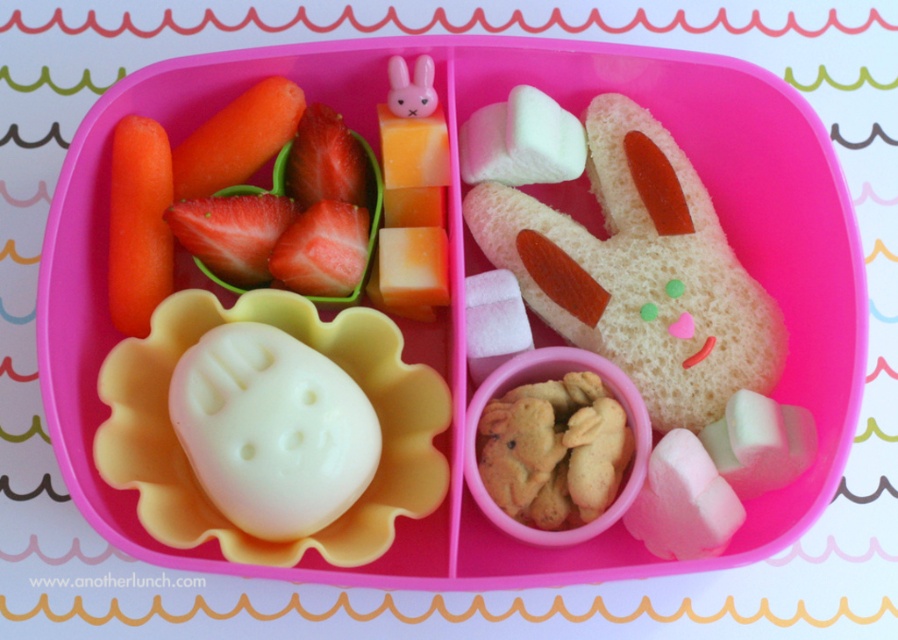
You are a child sitting at a table with the bento box in front of you. You want to grab the orange smooth carrot at left. Is it within your reach if your hand can extend 1.2 meters?

The orange smooth carrot at left is 1.16 meters away from the viewer, so yes, it is within reach since your hand can extend 1.2 meters.

You are looking at the bento box and need to place a sticker exactly at the center of the bento box. Which food item is closest to the sticker location? The sticker is placed at coordinates point A, which is at the center of the bento box. The center coordinates are point A at position 0.5, 0.5. The orange smooth carrot at left is located at point 0.350, 0.155. The bunny sandwich in the top right section is located at point 0.650, 0.150. The bottom left section has a piece of fruit at point 0.300, 0.850, so

The orange smooth carrot at left is closest to the sticker location because its coordinates are (138, 224), which is closer to the center point A at (449, 320) compared to the other items.

You are a child looking at the bento box. You want to find the red smooth strawberries at upper left. Can you tell me where exactly they are located in the bento box?

The red smooth strawberries at upper left are located at point [289,218] in the bento box.